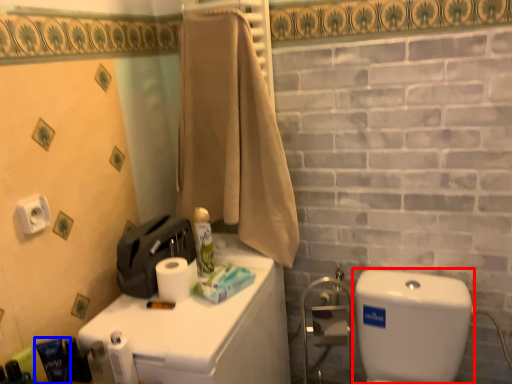
Question: Which object is closer to the camera taking this photo, water tank (highlighted by a red box) or toiletry (highlighted by a blue box)?

Choices:
 (A) water tank
 (B) toiletry

Answer: (A)